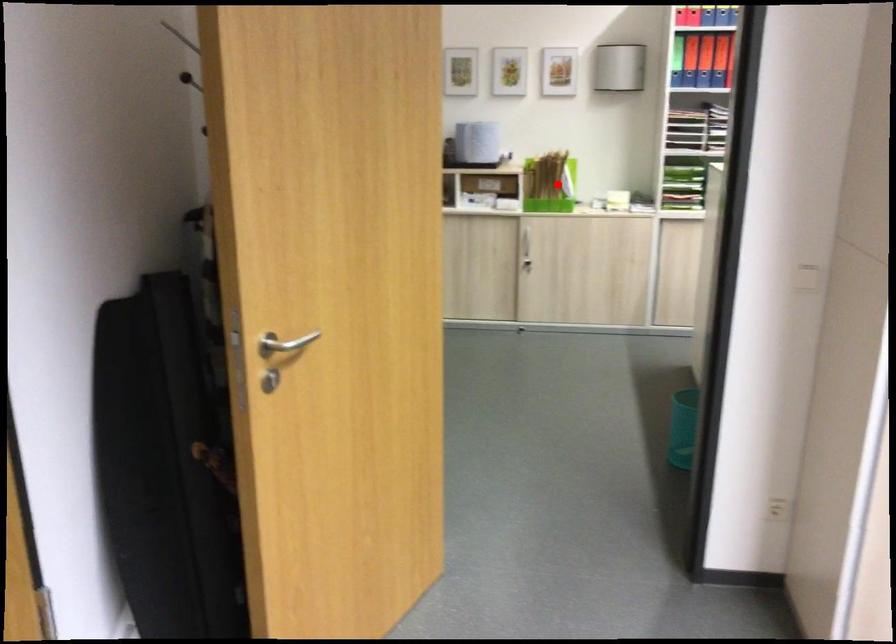
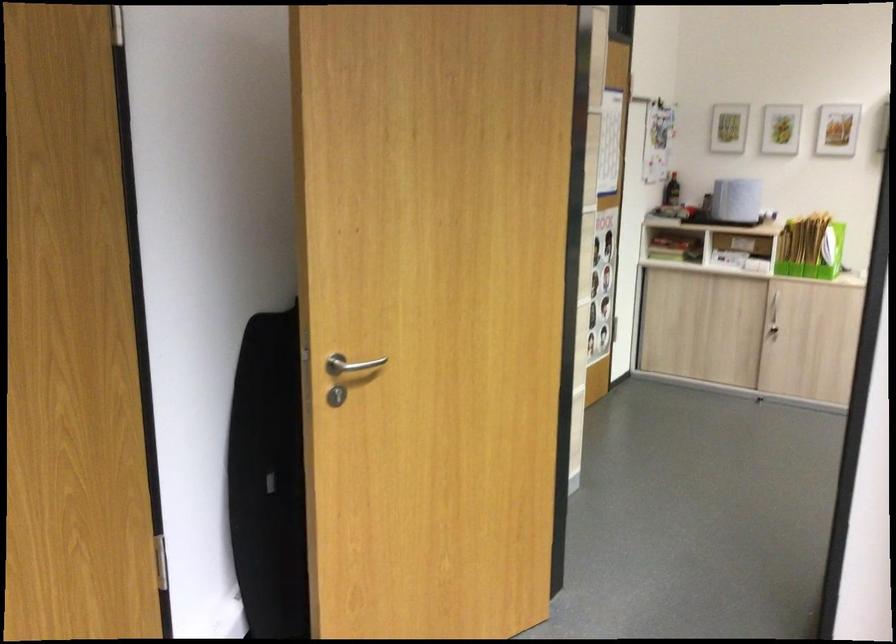
In the second image, find the point that corresponds to the highlighted location in the first image.

(810, 247)